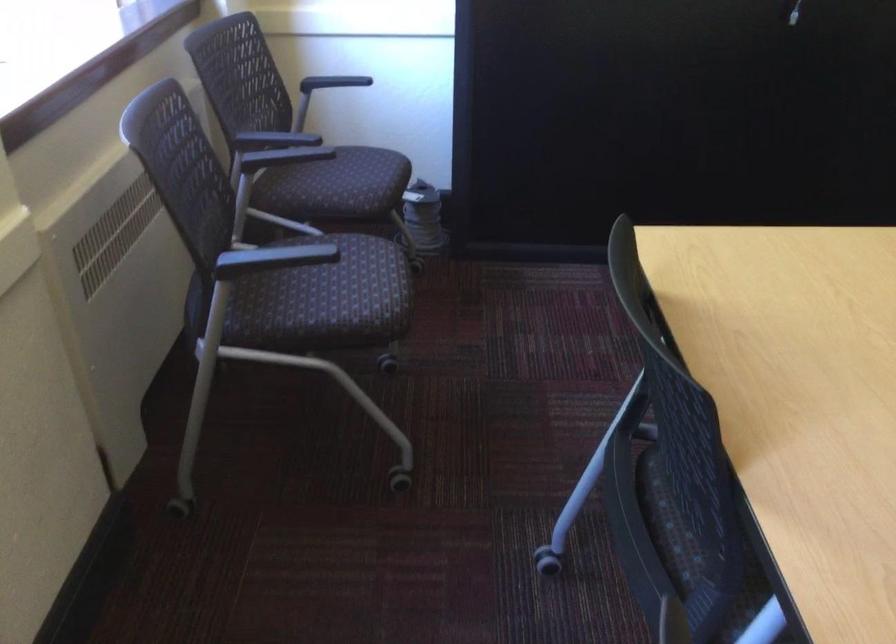
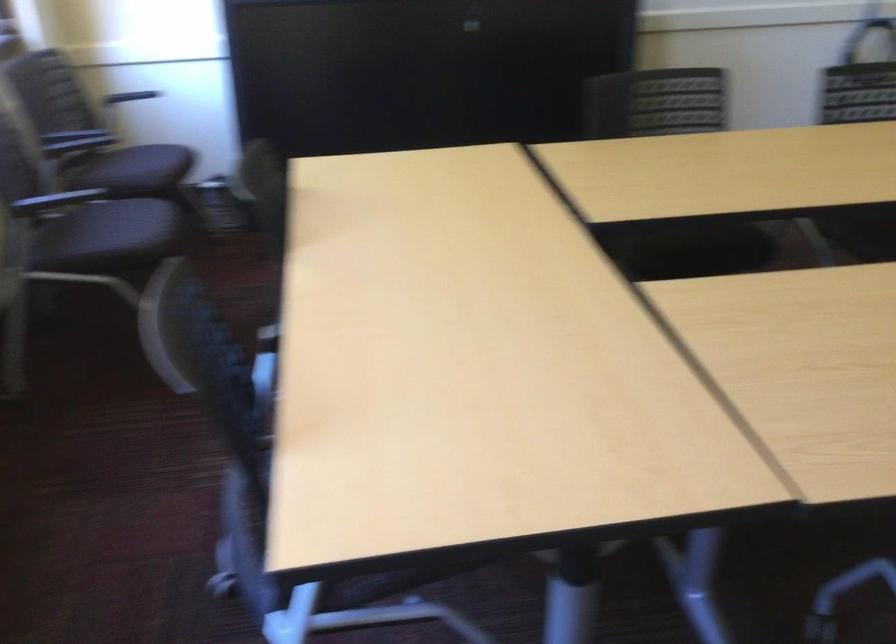
The point at (334, 295) is marked in the first image. Where is the corresponding point in the second image?

(116, 234)